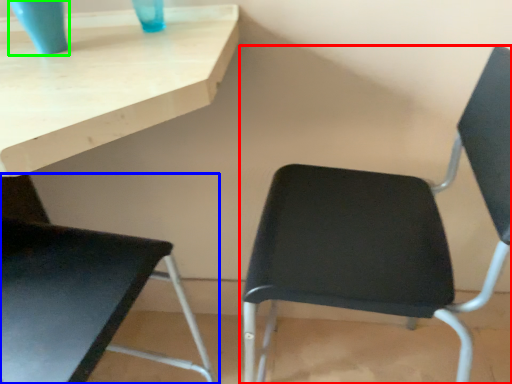
Question: Which object is the farthest from chair (highlighted by a red box)? Choose among these: chair (highlighted by a blue box) or glass vase (highlighted by a green box).

Choices:
 (A) chair
 (B) glass vase

Answer: (B)